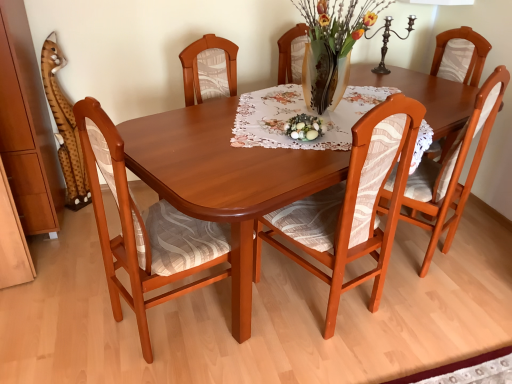
Find the location of a particular element. This screenshot has height=384, width=512. free region under wooden chair at left, which is the 3th chair from right to left (from a real-world perspective) is located at coordinates (187, 323).